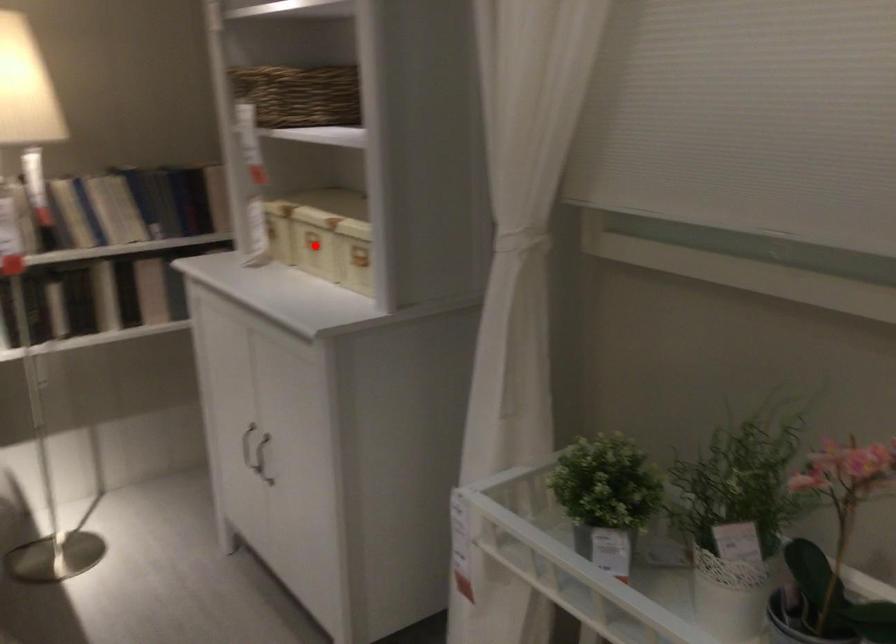
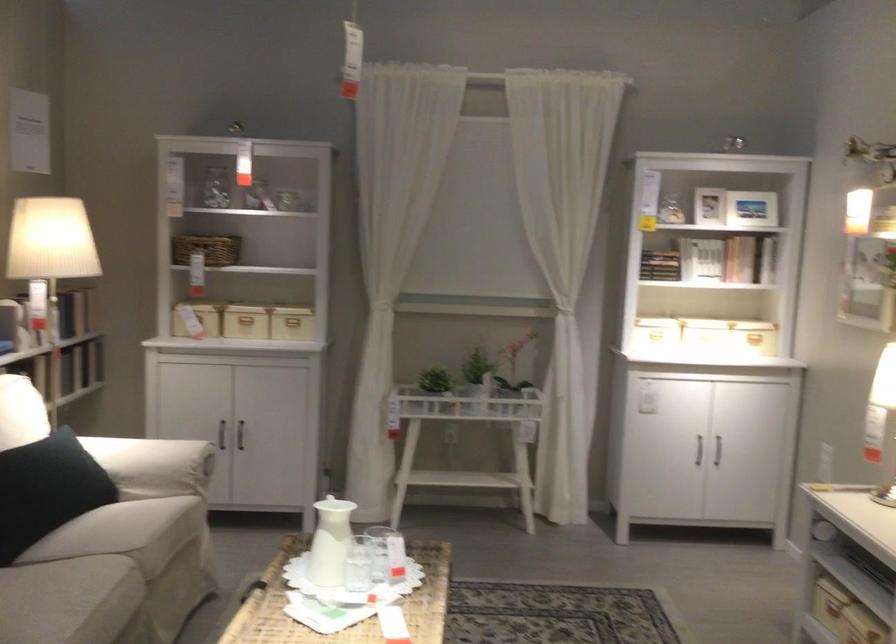
Question: A red point is marked in image1. In image2, is the corresponding 3D point closer to the camera or farther? Reply with the corresponding letter.

Choices:
 (A) The corresponding 3D point is closer.
 (B) The corresponding 3D point is farther.

Answer: (B)